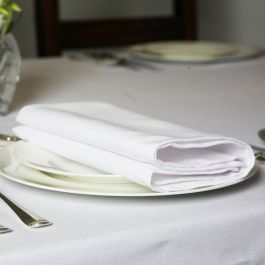
Where is `green plants in glass vase`? green plants in glass vase is located at coordinates (4, 14), (15, 8), (3, 1).